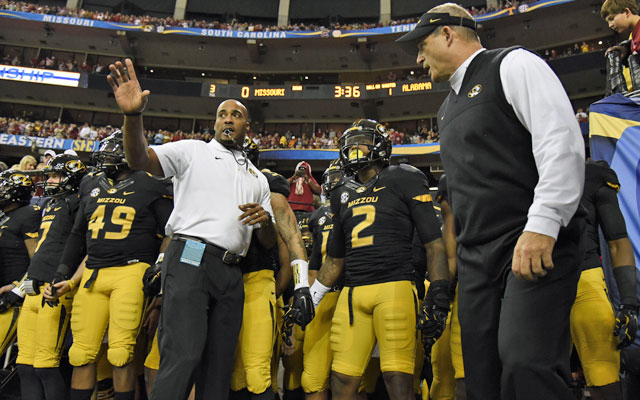
Find the location of a particular element. chest is located at coordinates (473, 125), (214, 179).